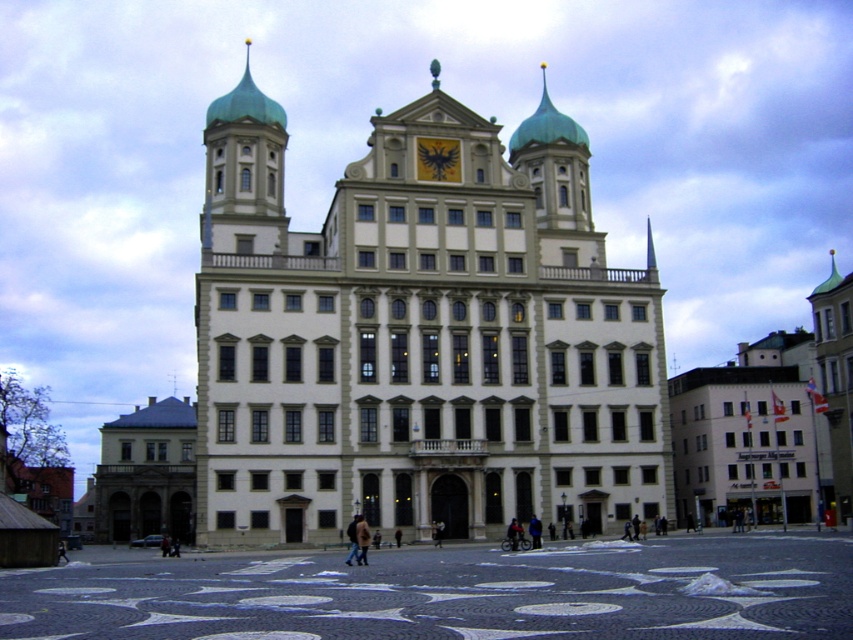
You are standing in the square facing the historic building. There are two points marked on the building facade. The first point is at coordinates point [248,218] and the second is at point [440,173]. Which point is closer to the entrance of the building?

Point [440,173] is closer to the entrance because it is in front of point [248,218].

You are standing in the square in front of the white stone building at center and want to take a photo of the gold metallic clock at center. Since the clock is part of the building, how does its position affect the framing of your photo?

The white stone building at center is closer to the viewer than the gold metallic clock at center, so you will need to adjust your angle or move closer to ensure the clock is in focus and properly framed within the shot.

Consider the image. You are an architect evaluating the proportions of the white stone building at center and the gold metallic clock at center in the image. Which object is wider?

The white stone building at center is wider than the gold metallic clock at center.